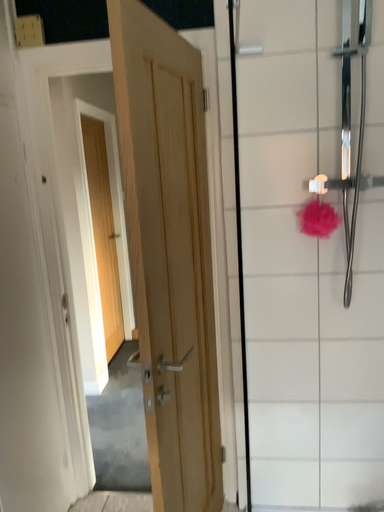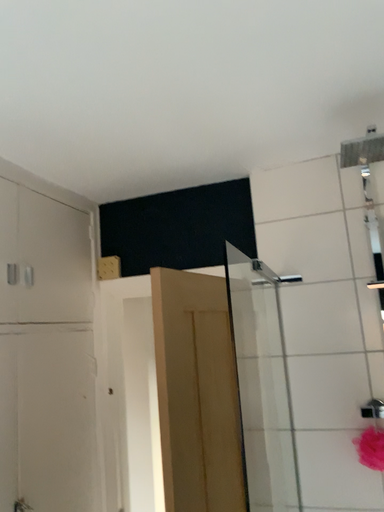
Question: Which way did the camera rotate in the video?

Choices:
 (A) rotated left
 (B) rotated right

Answer: (A)